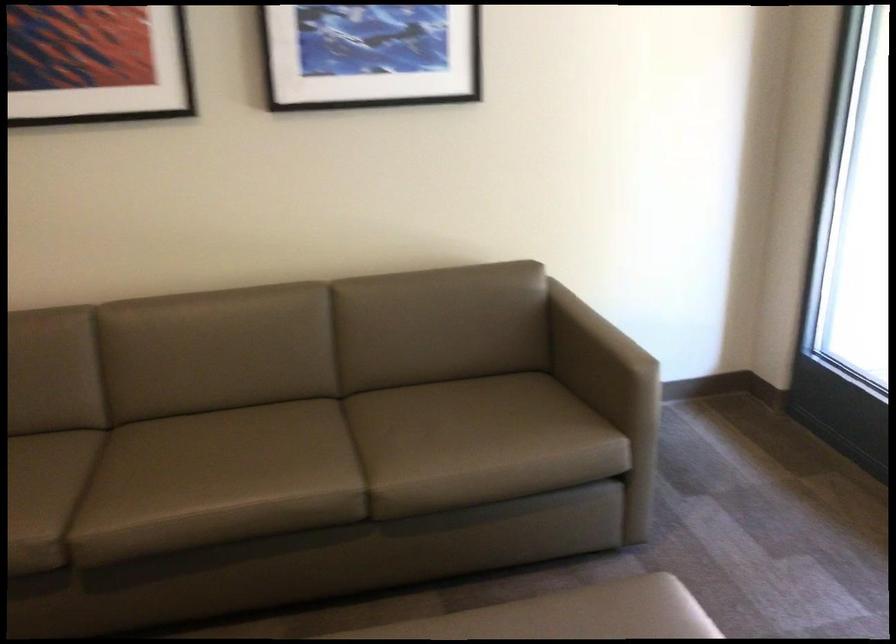
What do you see at coordinates (597, 355) in the screenshot? I see `a brown sofa armrest` at bounding box center [597, 355].